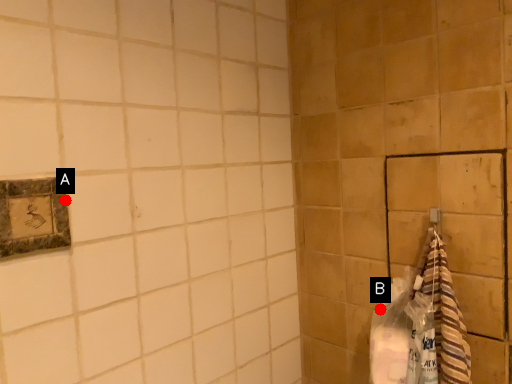
Question: Two points are circled on the image, labeled by A and B beside each circle. Which point is closer to the camera taking this photo?

Choices:
 (A) A is closer
 (B) B is closer

Answer: (A)